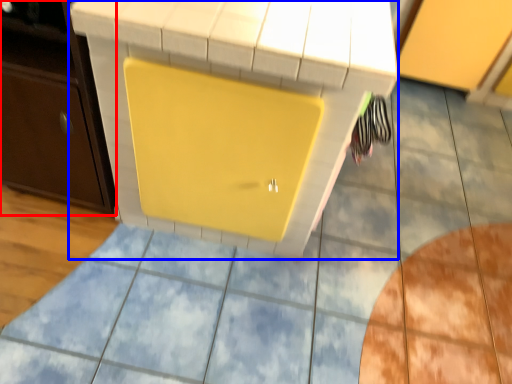
Question: Which object is further to the camera taking this photo, cabinetry (highlighted by a red box) or vanity (highlighted by a blue box)?

Choices:
 (A) cabinetry
 (B) vanity

Answer: (A)